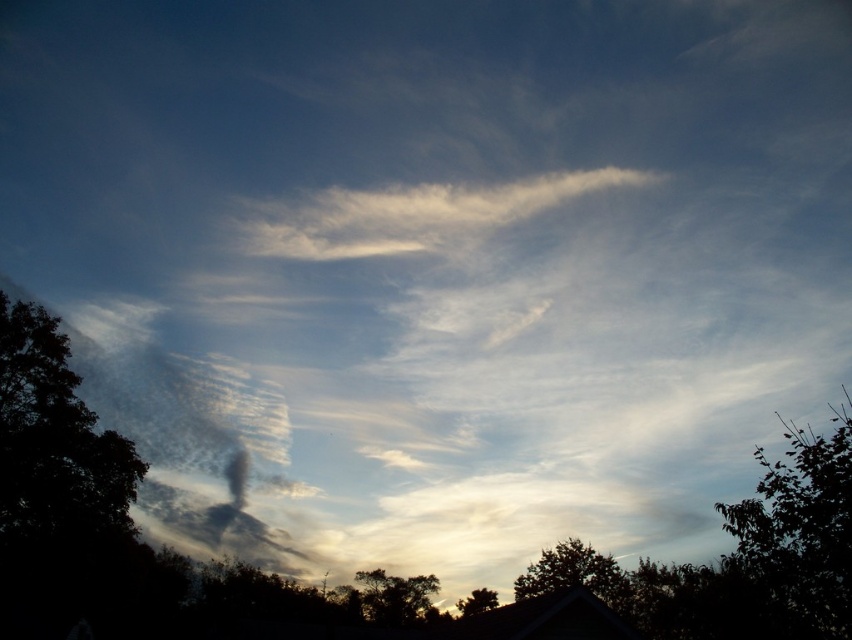
Question: Which point is farther from the camera taking this photo?

Choices:
 (A) (540, 550)
 (B) (318, 218)

Answer: (B)

Question: Can you confirm if silvery gray tree at lower center is positioned to the left of green leafy tree at lower center?

Choices:
 (A) yes
 (B) no

Answer: (B)

Question: Is white cotton cloud at upper center to the left of silvery metallic tree at lower center from the viewer's perspective?

Choices:
 (A) no
 (B) yes

Answer: (A)

Question: Observing the image, what is the correct spatial positioning of silvery gray foliage at right in reference to green leafy tree at lower center?

Choices:
 (A) left
 (B) right

Answer: (B)

Question: Which point appears farthest from the camera in this image?

Choices:
 (A) (367, 248)
 (B) (758, 483)
 (C) (110, 554)
 (D) (403, 600)

Answer: (B)

Question: Among these objects, which one is farthest from the camera?

Choices:
 (A) dark green leafy tree at left
 (B) white cotton cloud at upper center
 (C) silvery gray foliage at right

Answer: (B)